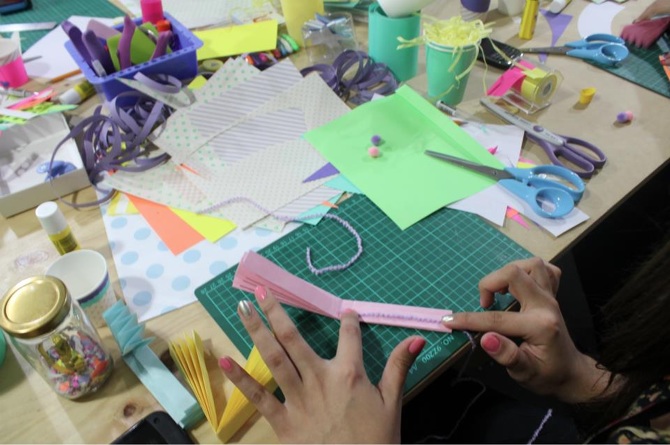
Where is `table`? The width and height of the screenshot is (670, 445). table is located at coordinates (639, 147).